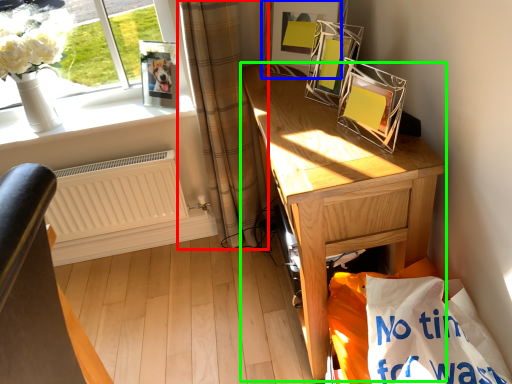
Question: Estimate the real-world distances between objects in this image. Which object is closer to curtain (highlighted by a red box), picture frame (highlighted by a blue box) or desk (highlighted by a green box)?

Choices:
 (A) picture frame
 (B) desk

Answer: (A)